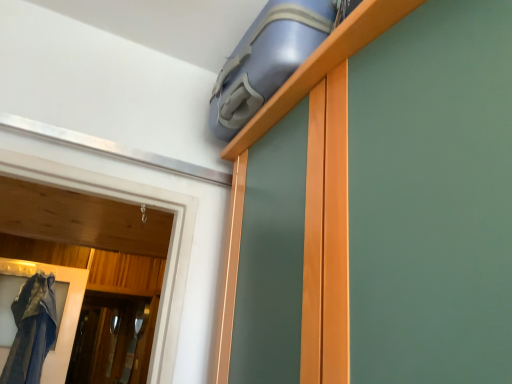
Question: Based on their positions, is transparent glass screen door at lower left located to the left or right of blue rubber suitcase at upper center?

Choices:
 (A) right
 (B) left

Answer: (B)

Question: From the image's perspective, relative to blue rubber suitcase at upper center, is transparent glass screen door at lower left above or below?

Choices:
 (A) below
 (B) above

Answer: (A)

Question: Looking at their shapes, would you say transparent glass screen door at lower left is wider or thinner than blue rubber suitcase at upper center?

Choices:
 (A) wide
 (B) thin

Answer: (B)

Question: Based on their sizes in the image, would you say blue rubber suitcase at upper center is bigger or smaller than transparent glass screen door at lower left?

Choices:
 (A) small
 (B) big

Answer: (B)

Question: From their relative heights in the image, would you say blue rubber suitcase at upper center is taller or shorter than transparent glass screen door at lower left?

Choices:
 (A) short
 (B) tall

Answer: (A)

Question: Is blue rubber suitcase at upper center spatially inside transparent glass screen door at lower left, or outside of it?

Choices:
 (A) outside
 (B) inside

Answer: (A)

Question: Considering their positions, is blue rubber suitcase at upper center located in front of or behind transparent glass screen door at lower left?

Choices:
 (A) front
 (B) behind

Answer: (A)